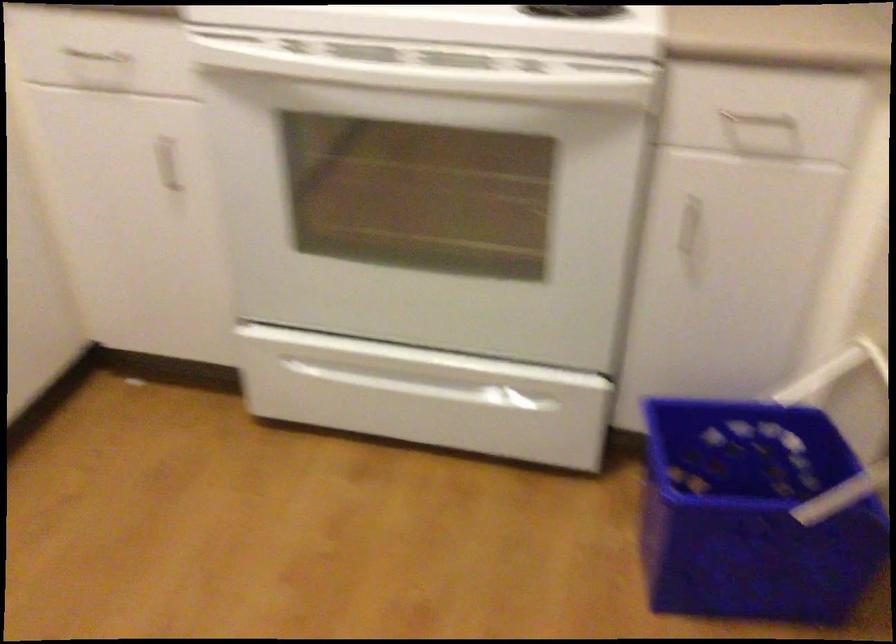
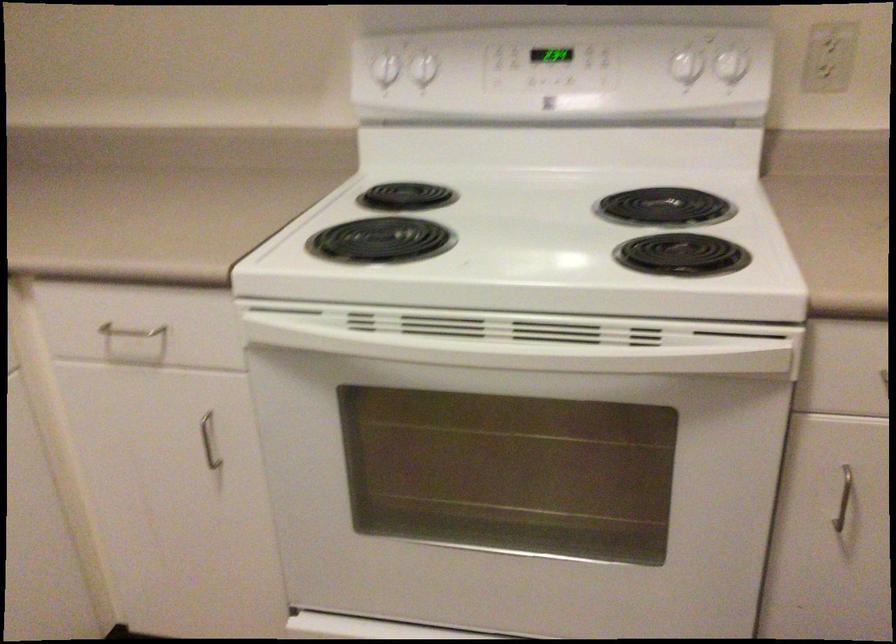
In the second image, find the point that corresponds to point (173, 176) in the first image.

(209, 440)